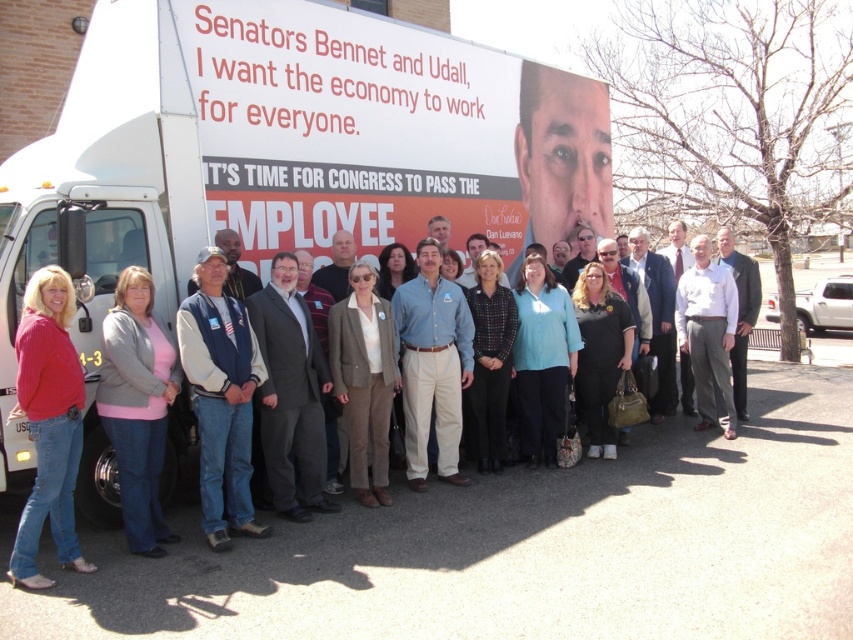
Question: Is smooth skin face at center bigger than blue denim shirt at center?

Choices:
 (A) yes
 (B) no

Answer: (A)

Question: Which point is closer to the camera?

Choices:
 (A) light blue shirt at center
 (B) dark gray suit at center
 (C) blue denim shirt at center
 (D) smooth skin face at center

Answer: (B)

Question: Is smooth skin face at center positioned at the back of white shirt at center?

Choices:
 (A) yes
 (B) no

Answer: (A)

Question: Based on their relative distances, which object is nearer to the light blue shirt at center?

Choices:
 (A) white shirt at center
 (B) blue denim shirt at center
 (C) denim jacket at center

Answer: (A)

Question: Is dark gray suit at center wider than blue denim shirt at center?

Choices:
 (A) no
 (B) yes

Answer: (A)

Question: Which point is closer to the camera?

Choices:
 (A) blue denim shirt at center
 (B) dark gray suit at center
 (C) denim jacket at center
 (D) gray fleece jacket at center

Answer: (D)